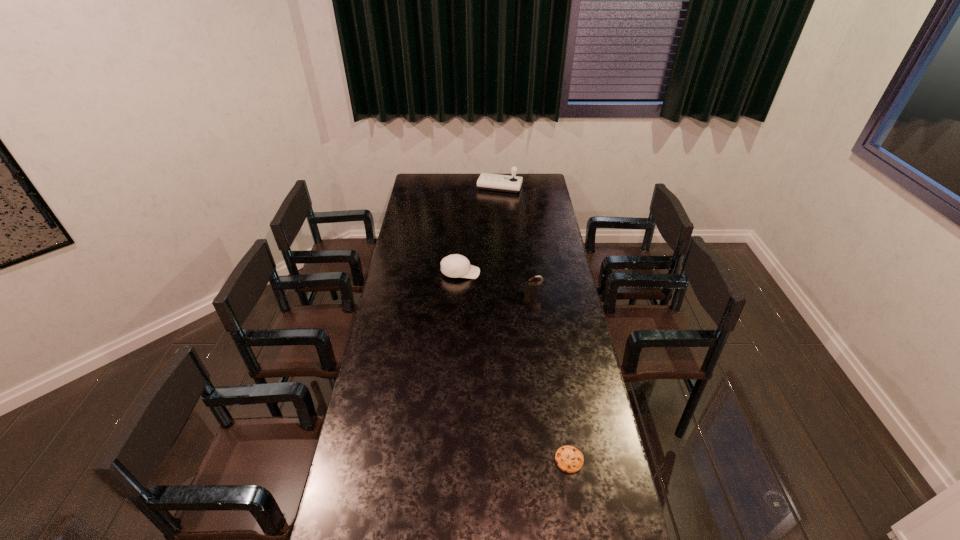
This screenshot has height=540, width=960. I want to click on free space that satisfies the following two spatial constraints: 1. on the front-facing side of the nearest object; 2. on the right side of the second farthest object, so click(451, 460).

Where is `vacant region that satisfies the following two spatial constraints: 1. with the keyhole on the front of the padlock; 2. on the right side of the nearest object`? The height and width of the screenshot is (540, 960). vacant region that satisfies the following two spatial constraints: 1. with the keyhole on the front of the padlock; 2. on the right side of the nearest object is located at coordinates (555, 460).

Where is `vacant position in the image that satisfies the following two spatial constraints: 1. on the front-facing side of the nearest object; 2. on the left side of the baseball cap`? Image resolution: width=960 pixels, height=540 pixels. vacant position in the image that satisfies the following two spatial constraints: 1. on the front-facing side of the nearest object; 2. on the left side of the baseball cap is located at coordinates (451, 460).

Locate an element on the screen. The image size is (960, 540). vacant position in the image that satisfies the following two spatial constraints: 1. on the front-facing side of the third nearest object; 2. on the left side of the cookie is located at coordinates pyautogui.click(x=451, y=460).

Locate an element on the screen. The image size is (960, 540). free space that satisfies the following two spatial constraints: 1. with the keyhole on the front of the padlock; 2. on the right side of the cookie is located at coordinates (555, 460).